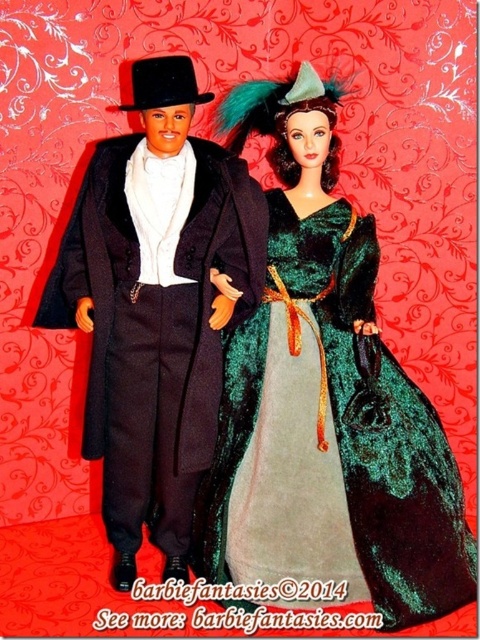
You are a photographer setting up a shot of the two dolls. You want to focus on the point that is closer to the camera. Which point should you choose between point [203,563] and point [97,374]?

Point [97,374] is closer to the camera than point [203,563], so you should choose point [97,374] to focus on.